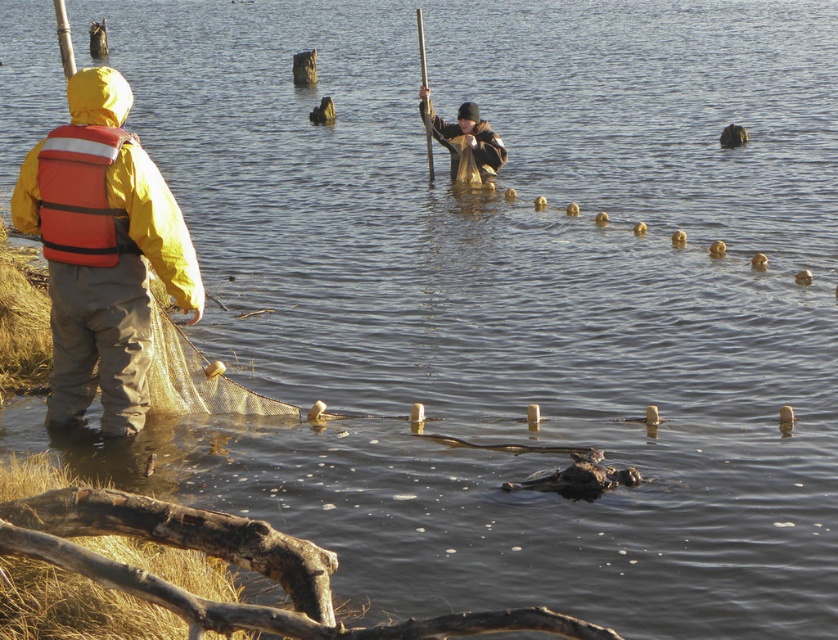
Question: Can you confirm if translucent mesh net at center is bigger than matte yellow jacket at center?

Choices:
 (A) yes
 (B) no

Answer: (B)

Question: Which point is closer to the camera?

Choices:
 (A) (158, 296)
 (B) (61, 221)
 (C) (489, 177)
 (D) (45, 240)

Answer: (B)

Question: Is matte yellow raincoat at left smaller than translucent mesh net at center?

Choices:
 (A) yes
 (B) no

Answer: (B)

Question: Estimate the real-world distances between objects in this image. Which object is farther from the matte yellow raincoat at left?

Choices:
 (A) orange fabric life jacket at left
 (B) translucent mesh net at center

Answer: (B)

Question: In this image, where is translucent mesh net at center located relative to matte yellow jacket at center?

Choices:
 (A) above
 (B) below

Answer: (B)

Question: Which of the following is the closest to the observer?

Choices:
 (A) matte yellow raincoat at left
 (B) translucent mesh net at center
 (C) orange fabric life jacket at left
 (D) matte yellow jacket at center

Answer: (A)